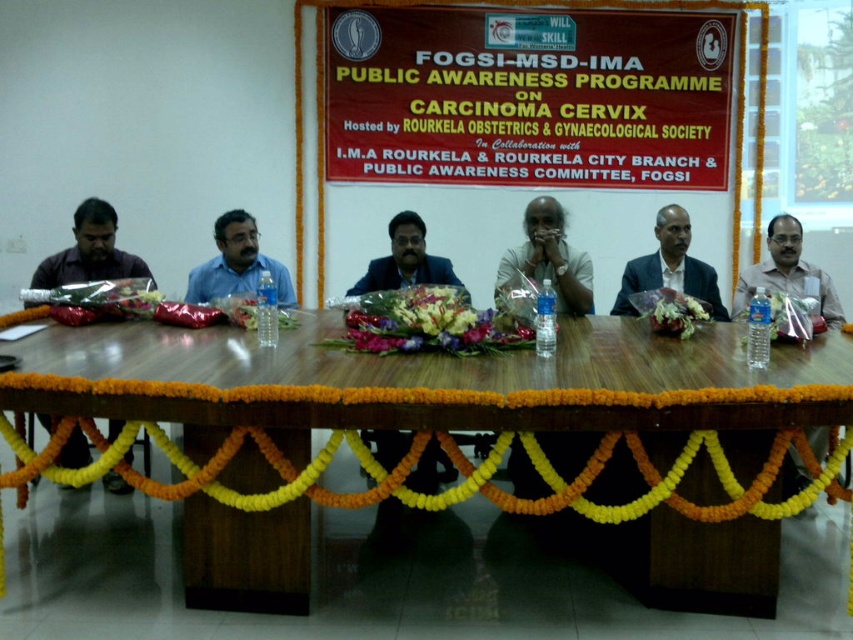
Does wooden table at center have a larger size compared to matte black shirt at center?

Yes.

Identify the location of wooden table at center. (444, 394).

Is point (640, 364) positioned in front of point (576, 314)?

Yes, it is in front of point (576, 314).

At what (x,y) coordinates should I click in order to perform the action: click on wooden table at center. Please return your answer as a coordinate pair (x, y). Looking at the image, I should click on (444, 394).

Can you confirm if matte black shirt at center is shorter than dark blue suit at center?

Correct, matte black shirt at center is not as tall as dark blue suit at center.

Between point (495, 291) and point (699, 278), which one is positioned in front?

Point (495, 291) is in front.

The height and width of the screenshot is (640, 853). Find the location of `matte black shirt at center`. matte black shirt at center is located at coordinates (550, 257).

Is matte blue shirt at center bigger than matte white shirt at right?

Actually, matte blue shirt at center might be smaller than matte white shirt at right.

Image resolution: width=853 pixels, height=640 pixels. What are the coordinates of `matte blue shirt at center` in the screenshot? It's located at (236, 264).

You are a GUI agent. You are given a task and a screenshot of the screen. Output one action in this format:
    pyautogui.click(x=<x>, y=<y>)
    Task: Click on the matte blue shirt at center
    The image size is (853, 640).
    Given the screenshot: What is the action you would take?
    pyautogui.click(x=236, y=264)